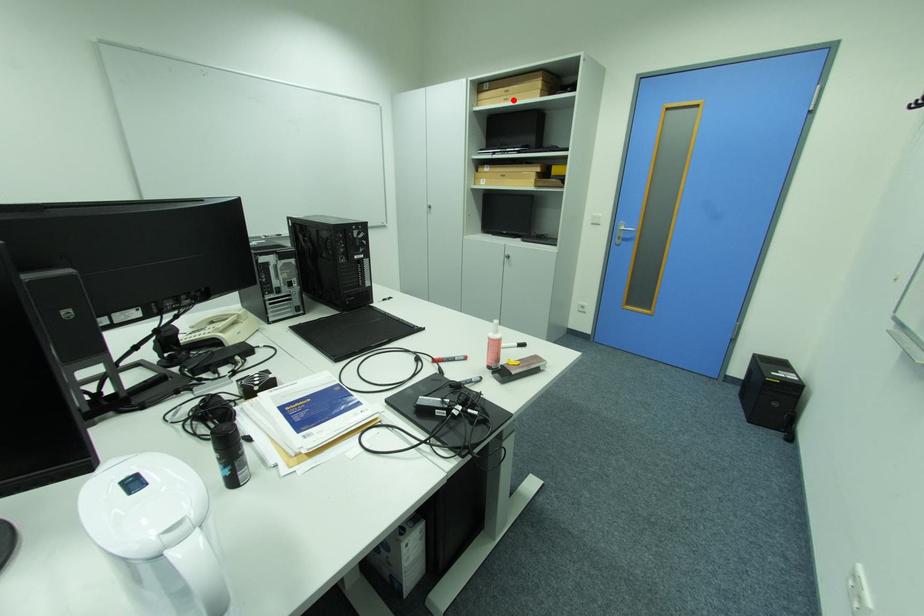
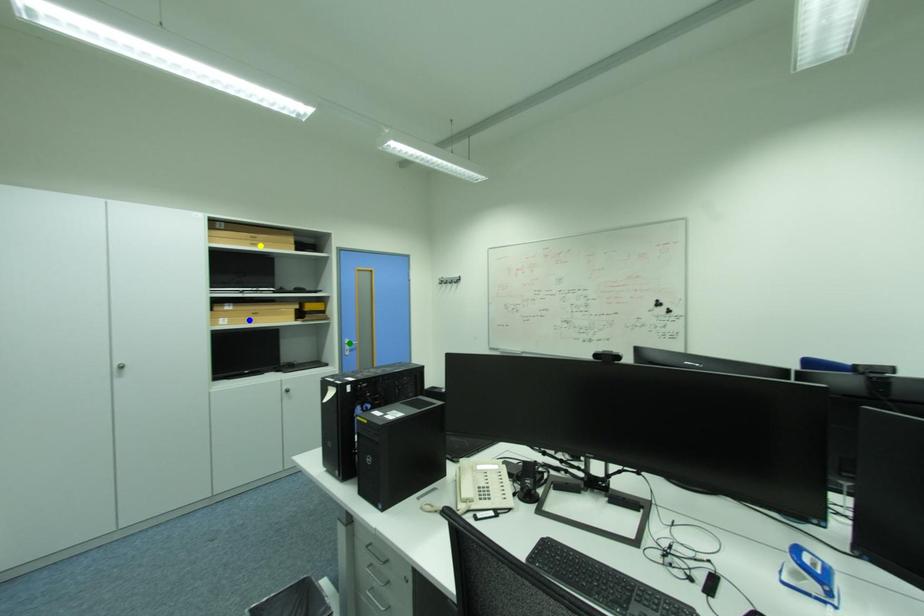
Question: I am providing you with two images of the same scene from different viewpoints. A red point is marked on the first image. You are given multiple points on the second image. Which mark in image 2 goes with the point in image 1?

Choices:
 (A) yellow point
 (B) green point
 (C) blue point

Answer: (A)